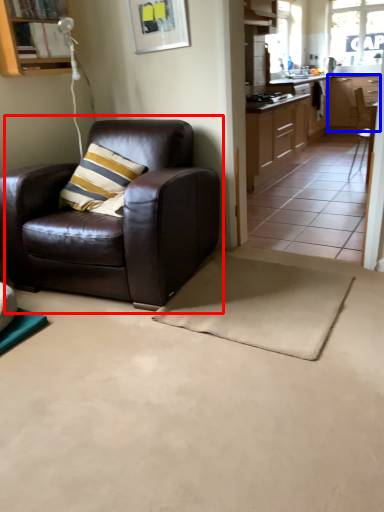
Question: Which point is further to the camera, chair (highlighted by a red box) or cabinetry (highlighted by a blue box)?

Choices:
 (A) chair
 (B) cabinetry

Answer: (B)